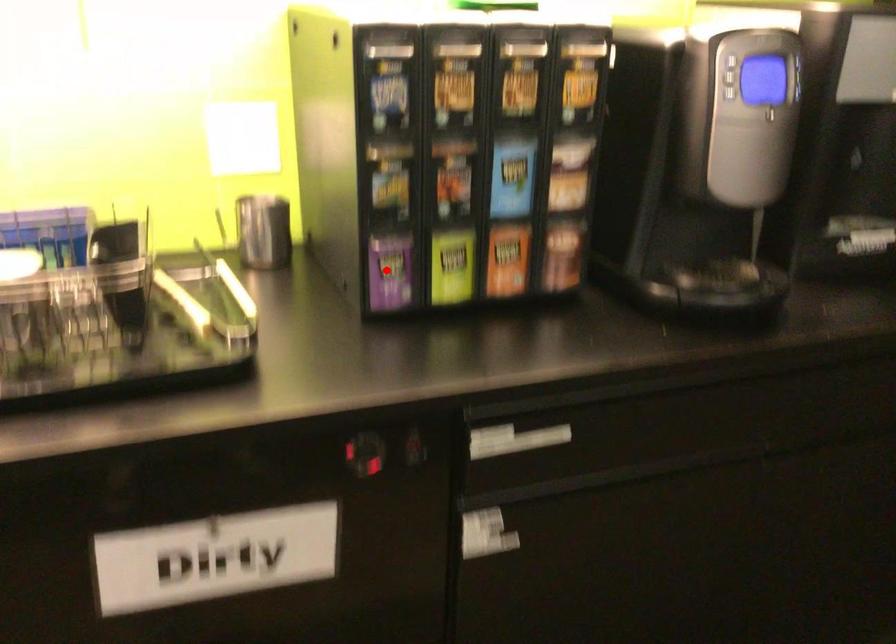
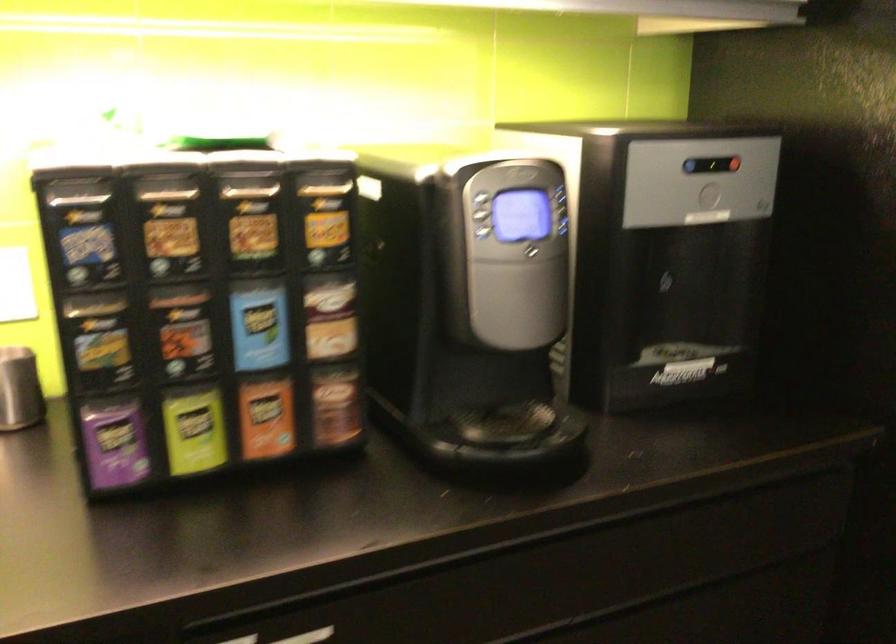
Question: A red point is marked in image1. In image2, is the corresponding 3D point closer to the camera or farther? Reply with the corresponding letter.

Choices:
 (A) The corresponding 3D point is closer.
 (B) The corresponding 3D point is farther.

Answer: (A)